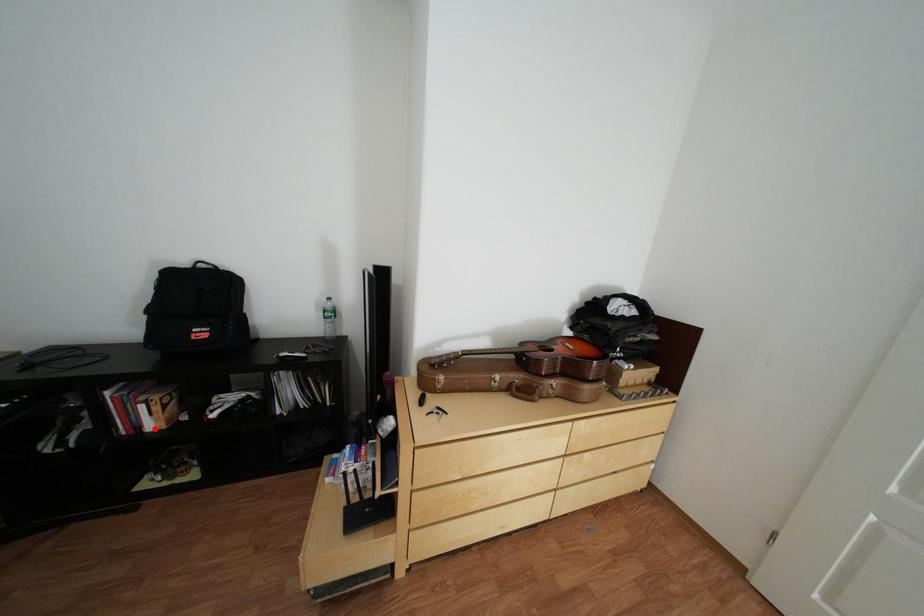
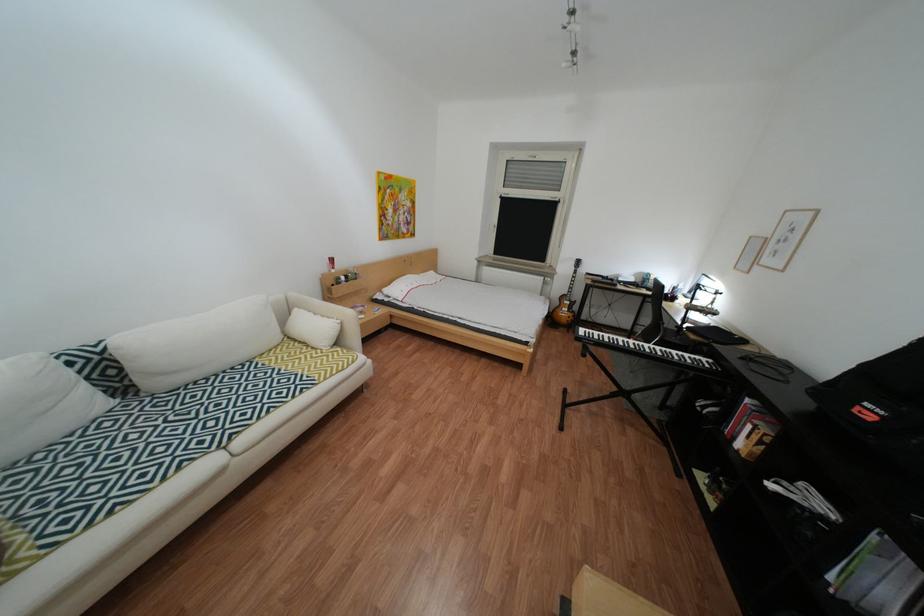
Locate, in the second image, the point that corresponds to the highlighted location in the first image.

(749, 439)